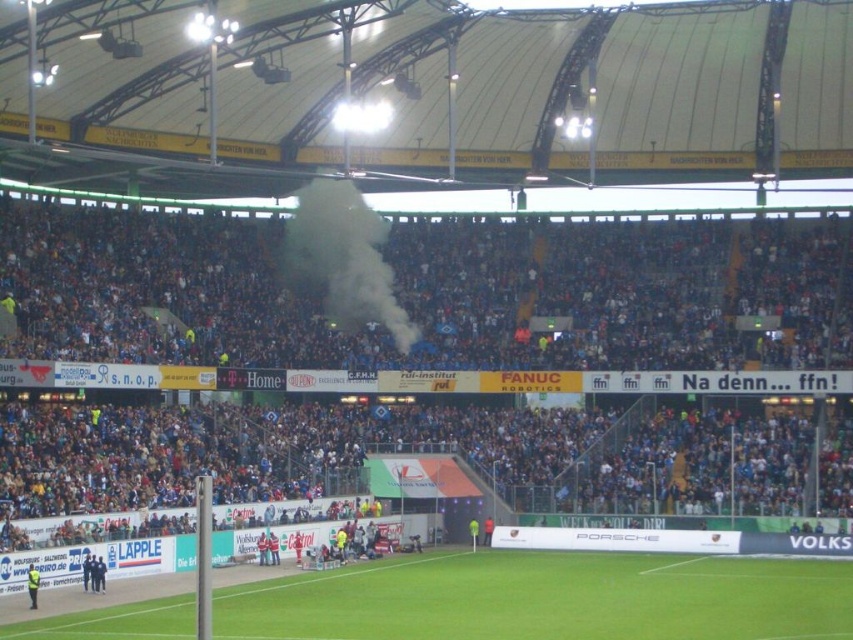
Question: Among these points, which one is nearest to the camera?

Choices:
 (A) (106, 224)
 (B) (306, 218)

Answer: (A)

Question: Does blue fabric crowd at upper center appear under white smoke at center?

Choices:
 (A) no
 (B) yes

Answer: (B)

Question: Is blue fabric crowd at upper center thinner than white smoke at center?

Choices:
 (A) yes
 (B) no

Answer: (B)

Question: Is blue fabric crowd at upper center in front of white smoke at center?

Choices:
 (A) yes
 (B) no

Answer: (A)

Question: Which object is farther from the camera taking this photo?

Choices:
 (A) green grass football field at center
 (B) white smoke at center
 (C) blue fabric crowd at upper center

Answer: (B)

Question: Considering the real-world distances, which object is closest to the green grass football field at center?

Choices:
 (A) blue fabric crowd at upper center
 (B) white smoke at center

Answer: (A)